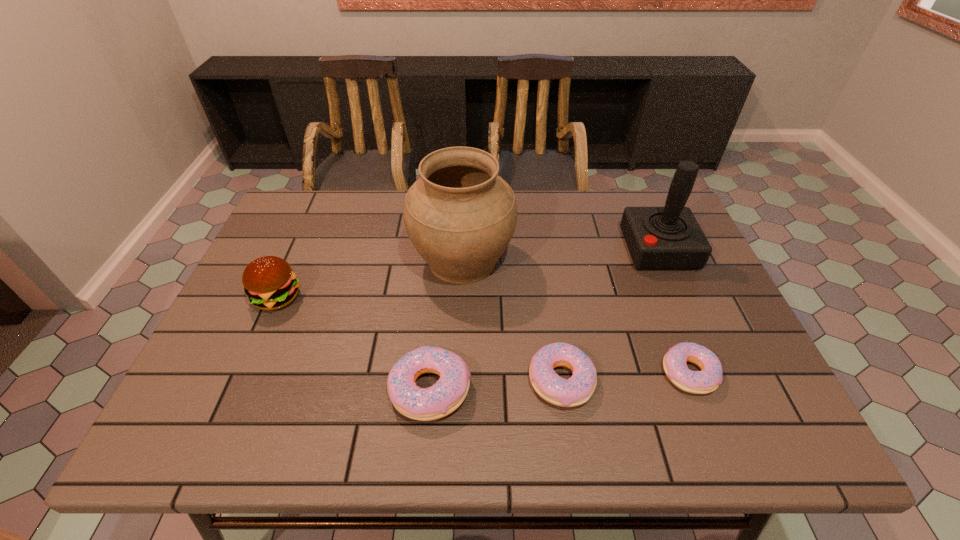
Please point out where to position a new doughnut on the left to maintain spacing. Please provide its 2D coordinates. Your answer should be formatted as a tuple, i.e. [(x, y)], where the tuple contains the x and y coordinates of a point satisfying the conditions above.

[(295, 397)]